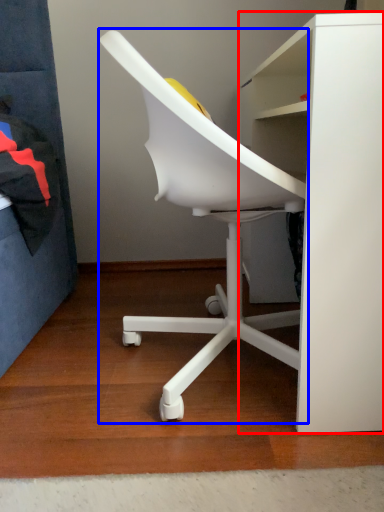
Question: Among these objects, which one is nearest to the camera, desk (highlighted by a red box) or chair (highlighted by a blue box)?

Choices:
 (A) desk
 (B) chair

Answer: (A)